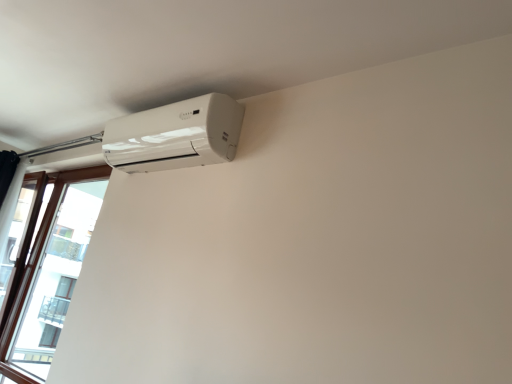
Question: Is brown wooden window at left taller or shorter than white glossy air conditioner at upper left?

Choices:
 (A) short
 (B) tall

Answer: (B)

Question: Considering the positions of brown wooden window at left and white glossy air conditioner at upper left in the image, is brown wooden window at left bigger or smaller than white glossy air conditioner at upper left?

Choices:
 (A) big
 (B) small

Answer: (A)

Question: In the image, is brown wooden window at left on the left side or the right side of white glossy air conditioner at upper left?

Choices:
 (A) left
 (B) right

Answer: (A)

Question: In terms of height, does white glossy air conditioner at upper left look taller or shorter compared to brown wooden window at left?

Choices:
 (A) short
 (B) tall

Answer: (A)

Question: From a real-world perspective, relative to brown wooden window at left, is white glossy air conditioner at upper left vertically above or below?

Choices:
 (A) above
 (B) below

Answer: (A)

Question: Considering the positions of white glossy air conditioner at upper left and brown wooden window at left in the image, is white glossy air conditioner at upper left bigger or smaller than brown wooden window at left?

Choices:
 (A) big
 (B) small

Answer: (B)

Question: Relative to brown wooden window at left, is white glossy air conditioner at upper left in front or behind?

Choices:
 (A) behind
 (B) front

Answer: (B)